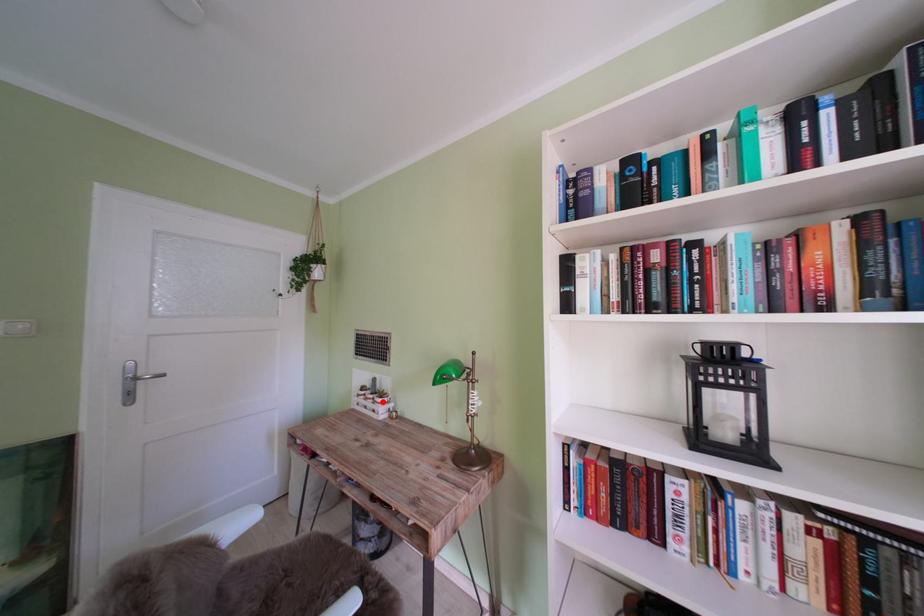
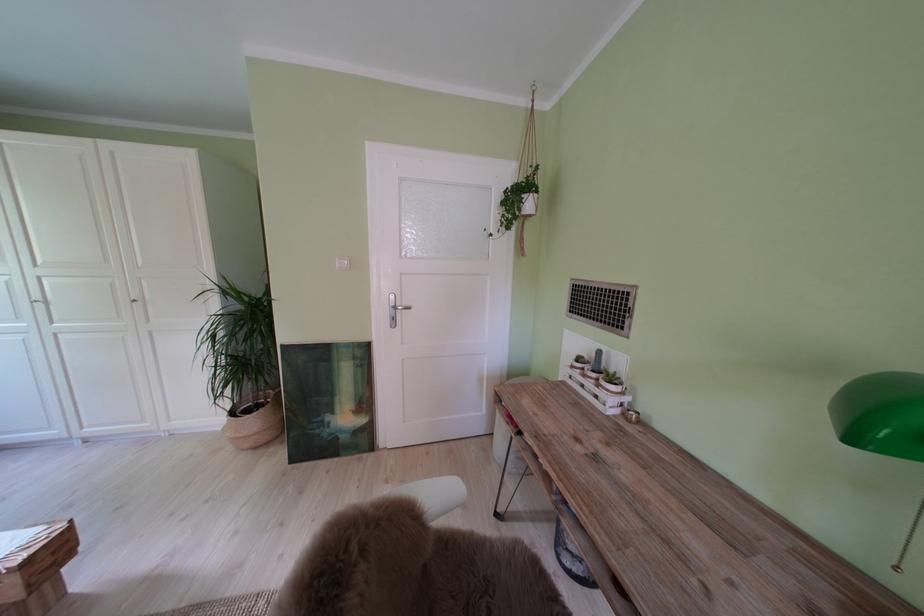
Find the pixel in the second image that matches the highlighted location in the first image.

(604, 381)